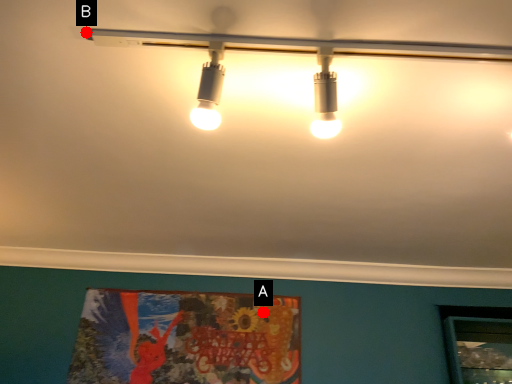
Question: Two points are circled on the image, labeled by A and B beside each circle. Which point is closer to the camera taking this photo?

Choices:
 (A) A is closer
 (B) B is closer

Answer: (B)